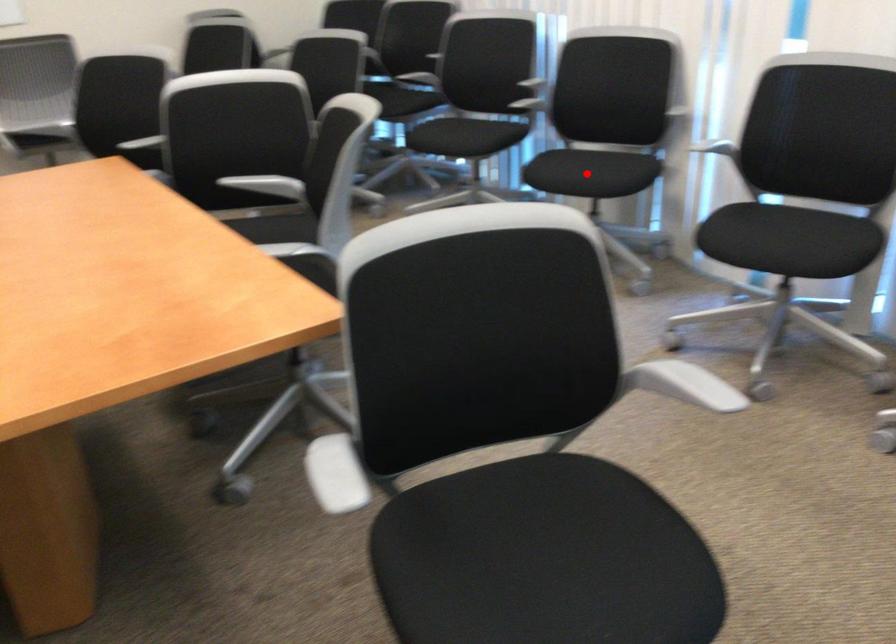
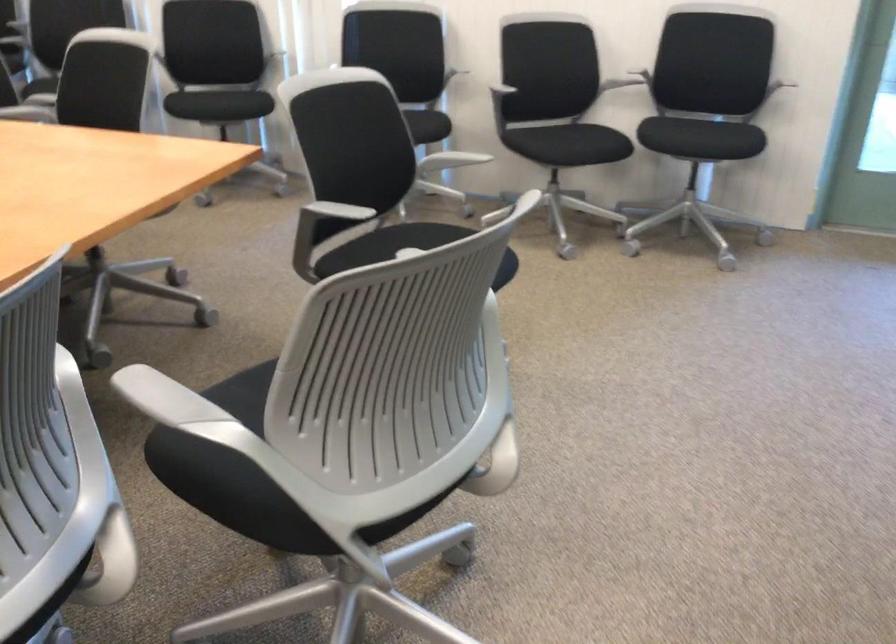
Question: I am providing you with two images of the same scene from different viewpoints. A red point is marked on the first image. Can you still see the location of the red point in image 2?

Choices:
 (A) Yes
 (B) No

Answer: (B)